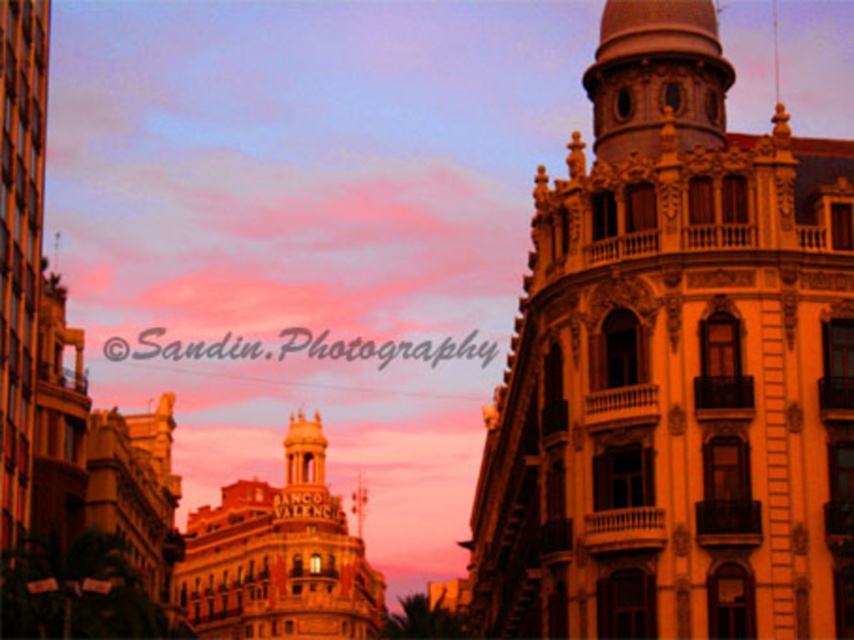
Question: Is golden stone tower at center bigger than gold textured building at center?

Choices:
 (A) no
 (B) yes

Answer: (A)

Question: Among these points, which one is nearest to the camera?

Choices:
 (A) (186, 524)
 (B) (522, 563)

Answer: (B)

Question: Is golden stone tower at center closer to camera compared to gold textured building at center?

Choices:
 (A) no
 (B) yes

Answer: (B)

Question: Observing the image, what is the correct spatial positioning of golden stone tower at center in reference to gold textured building at center?

Choices:
 (A) below
 (B) above

Answer: (B)